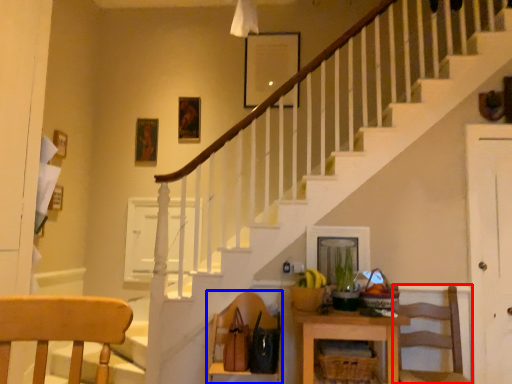
Question: Which point is further to the camera, chair (highlighted by a red box) or chair (highlighted by a blue box)?

Choices:
 (A) chair
 (B) chair

Answer: (B)